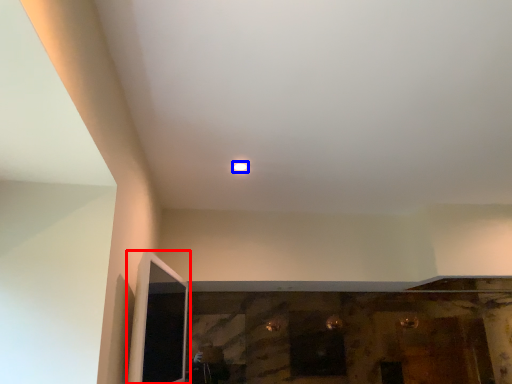
Question: Among these objects, which one is nearest to the camera, screen door (highlighted by a red box) or light (highlighted by a blue box)?

Choices:
 (A) screen door
 (B) light

Answer: (A)